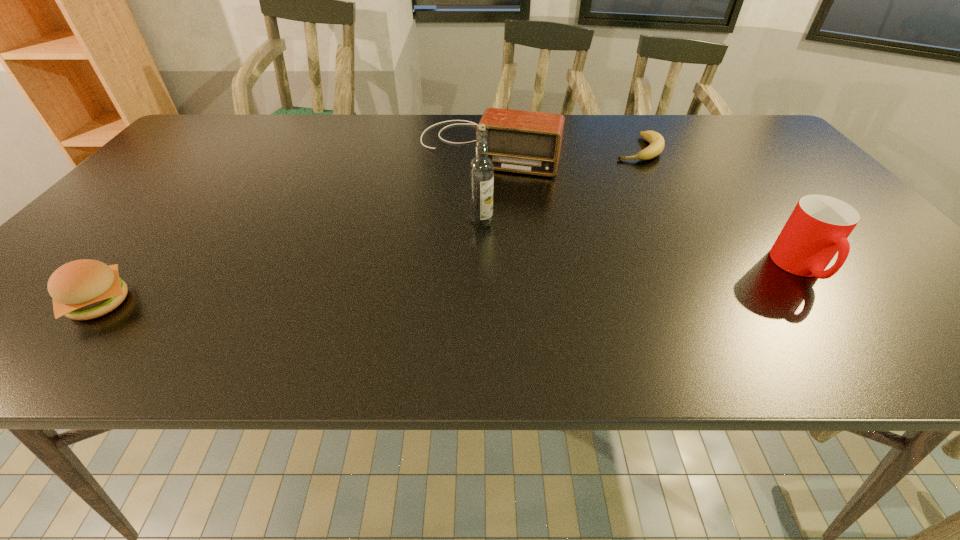
At what (x,y) coordinates should I click in order to perform the action: click on vacant area located 0.300m on the front-facing side of the radio receiver. Please return your answer as a coordinate pair (x, y). The width and height of the screenshot is (960, 540). Looking at the image, I should click on (440, 249).

This screenshot has width=960, height=540. I want to click on vacant area located on the front-facing side of the radio receiver, so click(x=427, y=276).

Find the location of a particular element. free spot located 0.350m at the stem of the banana is located at coordinates (585, 226).

Where is `vacant point located at the stem of the banana`? vacant point located at the stem of the banana is located at coordinates (620, 176).

Identify the location of free space located at the stem of the banana. This screenshot has height=540, width=960. (579, 235).

Find the location of `blank space located 0.060m on the label of the third nearest object`. blank space located 0.060m on the label of the third nearest object is located at coordinates (488, 247).

You are a GUI agent. You are given a task and a screenshot of the screen. Output one action in this format:
    pyautogui.click(x=<x>, y=<y>)
    Task: Click on the vacant position located on the label of the third nearest object
    The width and height of the screenshot is (960, 540).
    Given the screenshot: What is the action you would take?
    pyautogui.click(x=506, y=314)

The width and height of the screenshot is (960, 540). I want to click on vacant area located 0.130m on the label of the third nearest object, so click(493, 268).

At what (x,y) coordinates should I click in order to perform the action: click on radio receiver that is at the far edge. Please return your answer as a coordinate pair (x, y). This screenshot has width=960, height=540. Looking at the image, I should click on point(527,142).

I want to click on banana that is at the far edge, so click(x=657, y=143).